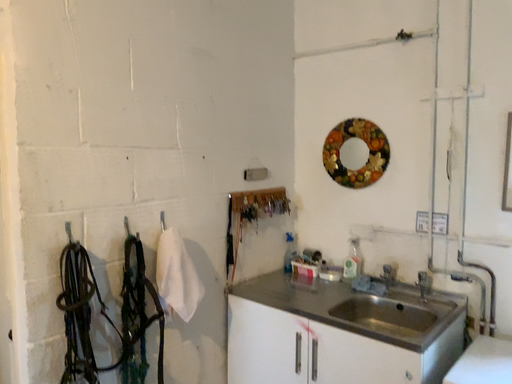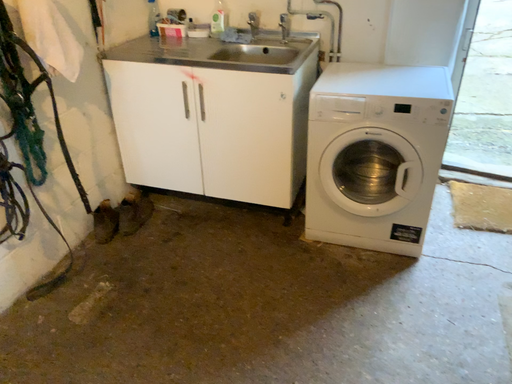
Question: How did the camera likely rotate when shooting the video?

Choices:
 (A) rotated downward
 (B) rotated upward

Answer: (A)